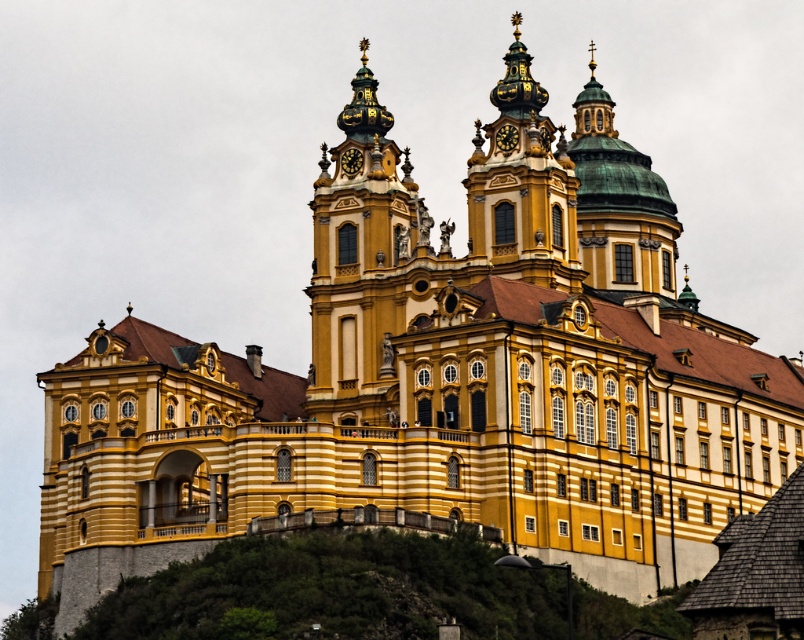
Looking at this image, you are a drone operator tasked with flying a drone between the golden stone tower at center and the green copper dome at upper center. The drone has a maximum flight distance of 10 meters. Can the drone safely make the trip without exceeding its range?

The distance between the golden stone tower at center and the green copper dome at upper center is 12.95 meters, which exceeds the drone operator has a maximum flight distance of 10 meters. Therefore, the drone cannot safely make the trip without exceeding its range.

You are an architect assessing the building for potential renovations. You need to determine which of the two towers, the golden stone tower at center or the gold ornate clock tower at upper center, requires more structural support due to its size. Which tower should you prioritize?

The golden stone tower at center is larger in size than the gold ornate clock tower at upper center, so it requires more structural support and should be prioritized.